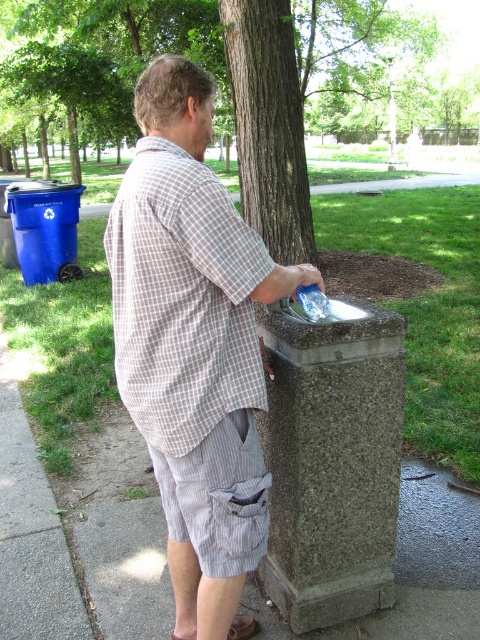
Is gray checkered shirt at center below clear plastic bottle at center?

Correct, gray checkered shirt at center is located below clear plastic bottle at center.

Is point (207, 534) closer to camera compared to point (303, 305)?

Yes, it is.

Is point (254, 298) farther from viewer compared to point (324, 307)?

No, it is not.

Where is `gray checkered shirt at center`? The height and width of the screenshot is (640, 480). gray checkered shirt at center is located at coordinates (192, 342).

From the picture: Does clear plastic bottle at center appear on the right side of brown leather sandal at lower center?

Correct, you'll find clear plastic bottle at center to the right of brown leather sandal at lower center.

Can you confirm if clear plastic bottle at center is positioned above brown leather sandal at lower center?

Yes.

The image size is (480, 640). What do you see at coordinates (312, 301) in the screenshot?
I see `clear plastic bottle at center` at bounding box center [312, 301].

Locate an element on the screen. This screenshot has width=480, height=640. clear plastic bottle at center is located at coordinates (312, 301).

Can you confirm if checkered fabric shirt at upper left is taller than clear plastic bottle at center?

A: Correct, checkered fabric shirt at upper left is much taller as clear plastic bottle at center.

Can you confirm if checkered fabric shirt at upper left is positioned below clear plastic bottle at center?

Yes, checkered fabric shirt at upper left is below clear plastic bottle at center.

Is point (134, 348) farther from viewer compared to point (298, 294)?

That is False.

Where is `checkered fabric shirt at upper left`? This screenshot has height=640, width=480. checkered fabric shirt at upper left is located at coordinates (181, 298).